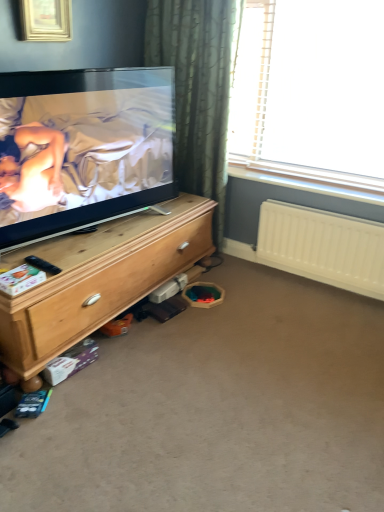
Find the location of a particular element. The image size is (384, 512). vacant area that lies between matte black tv at left and black plastic remote control at lower left is located at coordinates (97, 244).